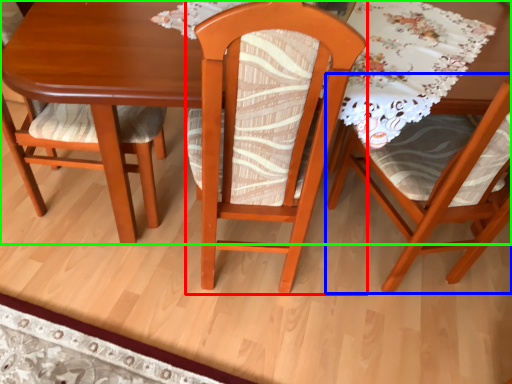
Question: Which is nearer to the chair (highlighted by a red box)? chair (highlighted by a blue box) or table (highlighted by a green box).

Choices:
 (A) chair
 (B) table

Answer: (B)